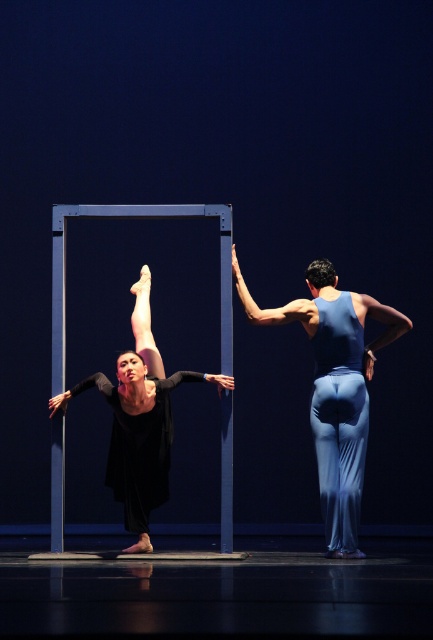
You are a costume designer preparing for a performance. You have two costume pieces available on stage, the blue fabric pants at center and the black matte dress at center. The director wants to choose the one that is smaller in size. Which costume piece should you select?

The blue fabric pants at center has a smaller size compared to the black matte dress at center, so you should select the blue fabric pants at center.

You are a photographer positioned at the front of the stage. You want to capture a closeup shot of the blue fabric pants at center and the black matte dress at center. Which one will appear larger in your photo?

The blue fabric pants at center will appear larger in the photo because it is closer to the photographer than the black matte dress at center.